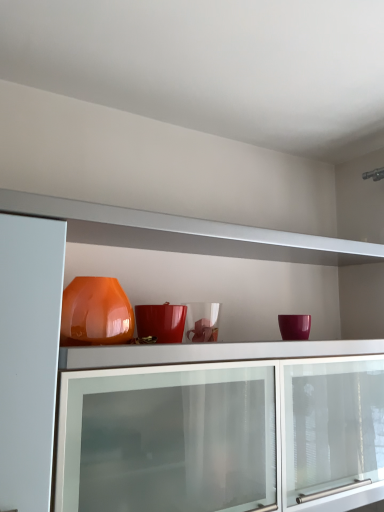
Question: Should I look upward or downward to see matte orange vase at upper center?

Choices:
 (A) down
 (B) up

Answer: (A)